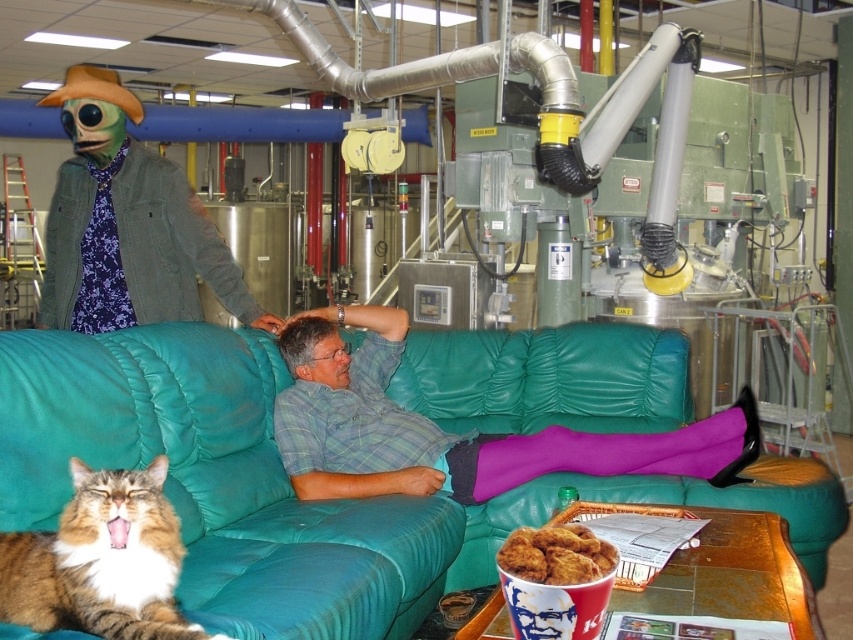
Question: Is tabby fur cat at lower left smaller than golden crispy chicken at lower center?

Choices:
 (A) no
 (B) yes

Answer: (A)

Question: Among these points, which one is farthest from the camera?

Choices:
 (A) (334, 454)
 (B) (561, 579)

Answer: (A)

Question: Is teal leather couch at center to the right of golden crispy chicken at lower center from the viewer's perspective?

Choices:
 (A) no
 (B) yes

Answer: (A)

Question: Can you confirm if plaid shirt at center is positioned below tabby fur cat at lower left?

Choices:
 (A) no
 (B) yes

Answer: (A)

Question: Which point is closer to the camera?

Choices:
 (A) teal leather couch at center
 (B) plaid shirt at center

Answer: (A)

Question: Which is nearer to the teal leather couch at center?

Choices:
 (A) golden crispy chicken at lower center
 (B) tabby fur cat at lower left
 (C) plaid shirt at center

Answer: (C)